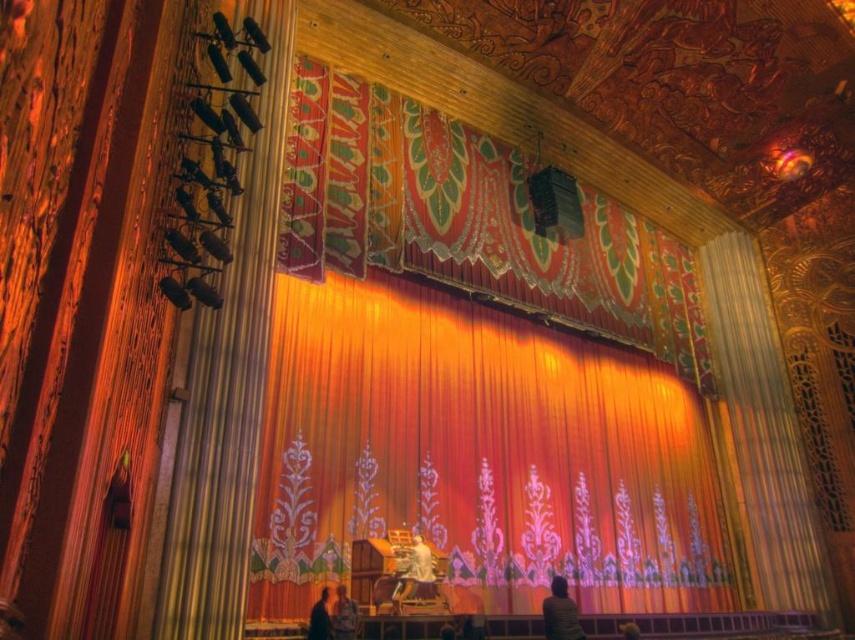
Question: Which point is farther from the camera taking this photo?

Choices:
 (A) (544, 598)
 (B) (722, 394)

Answer: (B)

Question: Can you confirm if orange velvet curtain at center is positioned below dark brown leather jacket at lower center?

Choices:
 (A) yes
 (B) no

Answer: (B)

Question: Does gold textured curtain at right appear on the left side of smooth beige shirt at lower center?

Choices:
 (A) yes
 (B) no

Answer: (B)

Question: Does gold textured curtain at right have a smaller size compared to smooth beige shirt at lower center?

Choices:
 (A) no
 (B) yes

Answer: (A)

Question: Which is nearer to the white cotton shirt at center?

Choices:
 (A) orange velvet curtain at center
 (B) dark brown leather jacket at lower center
 (C) gold textured curtain at right
 (D) smooth beige shirt at lower center

Answer: (D)

Question: Which object appears closest to the camera in this image?

Choices:
 (A) gold textured curtain at right
 (B) smooth white shirt at lower center

Answer: (B)